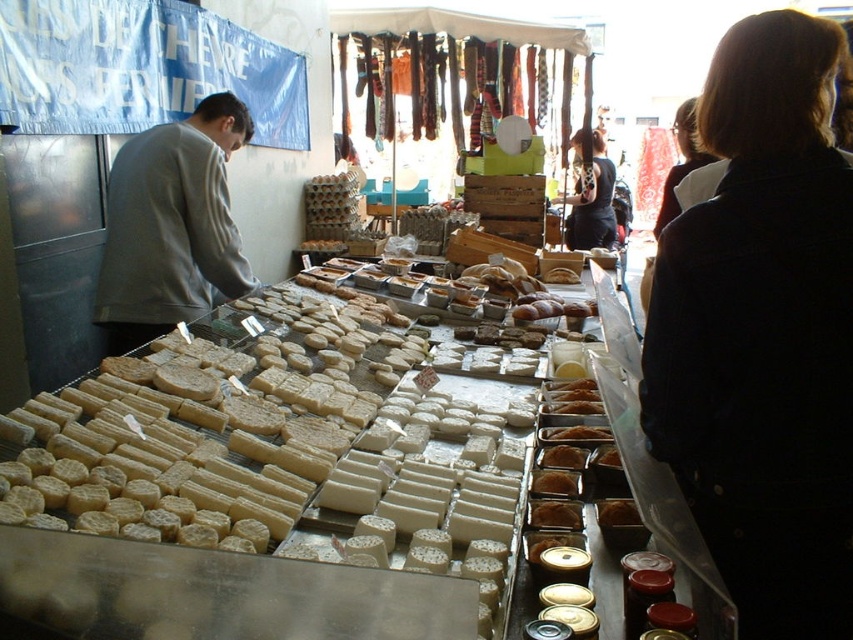
Who is more distant from viewer, (756, 404) or (169, 310)?

Point (169, 310)

Who is positioned more to the left, dark blue denim jacket at upper right or gray matte sweatshirt at left?

Positioned to the left is gray matte sweatshirt at left.

This screenshot has height=640, width=853. What do you see at coordinates (763, 333) in the screenshot?
I see `dark blue denim jacket at upper right` at bounding box center [763, 333].

The width and height of the screenshot is (853, 640). What are the coordinates of `dark blue denim jacket at upper right` in the screenshot? It's located at (763, 333).

Which of these two, black leather jacket at center or dark brown hair at upper right, stands taller?

With more height is dark brown hair at upper right.

Is point (589, 202) positioned behind point (682, 172)?

Yes.

Locate an element on the screen. This screenshot has height=640, width=853. black leather jacket at center is located at coordinates (590, 198).

Which of these two, dark blue denim jacket at upper right or black leather jacket at center, stands taller?

Standing taller between the two is black leather jacket at center.

Is point (784, 516) positioned in front of point (605, 173)?

Yes, point (784, 516) is closer to viewer.

Is point (746, 243) farther from viewer compared to point (612, 186)?

No, (746, 243) is closer to viewer.

I want to click on dark blue denim jacket at upper right, so click(763, 333).